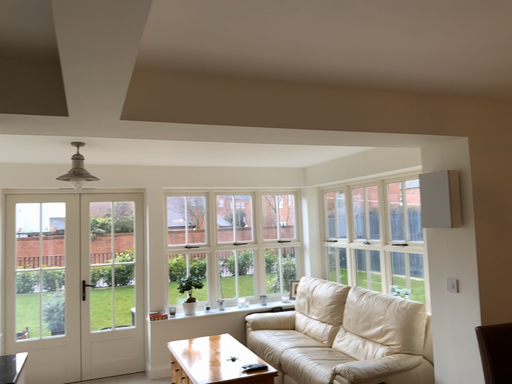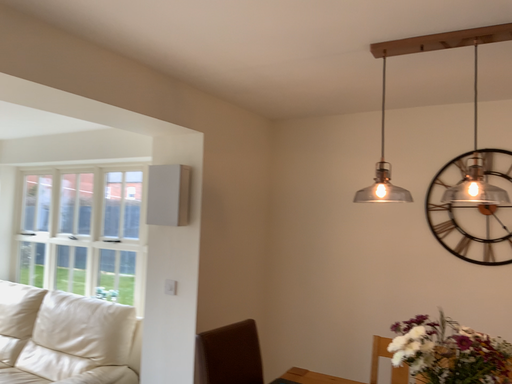
Question: Which way did the camera rotate in the video?

Choices:
 (A) rotated left
 (B) rotated right

Answer: (B)